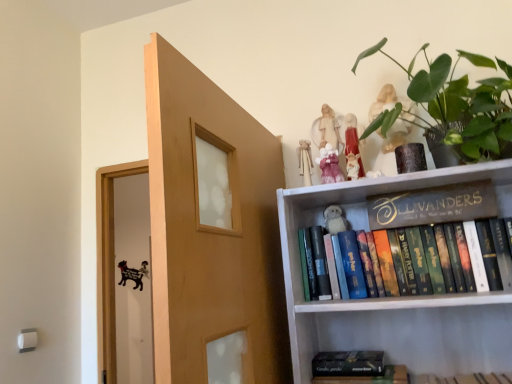
The image size is (512, 384). Find the location of `matte white figurine at upper center, the 3th toy viewed from the front`. matte white figurine at upper center, the 3th toy viewed from the front is located at coordinates click(305, 162).

Measure the distance between point (384, 245) and camera.

The distance of point (384, 245) from camera is 4.36 feet.

What do you see at coordinates (456, 105) in the screenshot? The width and height of the screenshot is (512, 384). I see `green leafy plant at upper right` at bounding box center [456, 105].

Locate an element on the screen. The height and width of the screenshot is (384, 512). light brown wood door at center is located at coordinates (211, 228).

Find the location of a particular element. This screenshot has width=512, height=384. hardcover book at lower center, the 1th book when ordered from bottom to top is located at coordinates (356, 368).

Measure the distance between point (364,354) and camera.

A distance of 4.62 feet exists between point (364,354) and camera.

Find the location of a particular element. This screenshot has width=512, height=384. matte white figurine at upper center, arranged as the second toy when viewed from the back is located at coordinates (305, 162).

Considering the positions of objects pink fabric doll at upper center, the second toy when ordered from front to back, and gold metallic sign at upper right, the third book from the bottom, in the image provided, who is behind, pink fabric doll at upper center, the second toy when ordered from front to back, or gold metallic sign at upper right, the third book from the bottom,?

pink fabric doll at upper center, the second toy when ordered from front to back, is more distant.

From the image's perspective, between pink fabric doll at upper center, the second toy when ordered from front to back, and gold metallic sign at upper right, the third book from the bottom, which one is located above?

pink fabric doll at upper center, the second toy when ordered from front to back.

From the gold metallic sign at upper right, the third book from the bottom, count the 3rd toy to the left and point to it. Please provide its 2D coordinates.

[(329, 165)]

Which point is more distant from viewer, (466, 90) or (362, 360)?

The point (362, 360) is more distant.

Considering the sizes of objects green leafy plant at upper right and hardcover book at lower center, the third book from the top, in the image provided, who is bigger, green leafy plant at upper right or hardcover book at lower center, the third book from the top,?

Bigger between the two is green leafy plant at upper right.

You are a GUI agent. You are given a task and a screenshot of the screen. Output one action in this format:
    pyautogui.click(x=<x>, y=<y>)
    Task: Click on the houseplant above the hardcover book at lower center, the third book from the top (from a real-world perspective)
    
    Given the screenshot: What is the action you would take?
    pyautogui.click(x=456, y=105)

Can you see green leafy plant at upper right touching hardcover book at lower center, the 1th book when ordered from bottom to top?

They are not placed beside each other.

Is green leafy plant at upper right wider or thinner than light brown wood door at center?

Clearly, green leafy plant at upper right has more width compared to light brown wood door at center.

How distant is green leafy plant at upper right from light brown wood door at center?

A distance of 58.54 centimeters exists between green leafy plant at upper right and light brown wood door at center.

Is green leafy plant at upper right facing towards light brown wood door at center?

No, green leafy plant at upper right is not facing towards light brown wood door at center.

Which object is further away from the camera, green leafy plant at upper right or light brown wood door at center?

Positioned behind is green leafy plant at upper right.

From the image's perspective, relative to white plush toy at upper center, acting as the 4th toy starting from the front, is light brown wood door at center above or below?

light brown wood door at center is situated lower than white plush toy at upper center, acting as the 4th toy starting from the front, in the image.

Could you measure the distance between light brown wood door at center and white plush toy at upper center, arranged as the 1th toy when viewed from the back?

light brown wood door at center is 18.35 inches away from white plush toy at upper center, arranged as the 1th toy when viewed from the back.

Is light brown wood door at center located outside white plush toy at upper center, arranged as the 1th toy when viewed from the back?

Absolutely, light brown wood door at center is external to white plush toy at upper center, arranged as the 1th toy when viewed from the back.

Is light brown wood door at center next to white plush toy at upper center, arranged as the 1th toy when viewed from the back, and touching it?

No, light brown wood door at center is not beside white plush toy at upper center, arranged as the 1th toy when viewed from the back.

Which is less distant, (x=357, y=382) or (x=389, y=248)?

The point (x=357, y=382) is in front.

Visually, is hardcover book at lower center, the third book from the top, positioned to the left or to the right of hardcover books at upper right, positioned as the 2th book in top-to-bottom order?

hardcover book at lower center, the third book from the top, is to the left of hardcover books at upper right, positioned as the 2th book in top-to-bottom order.

Which of these two, hardcover book at lower center, the 1th book when ordered from bottom to top, or hardcover books at upper right, which is the 2th book in bottom-to-top order, stands taller?

With more height is hardcover books at upper right, which is the 2th book in bottom-to-top order.

Can you tell me how much hardcover book at lower center, the third book from the top, and hardcover books at upper right, which is the 2th book in bottom-to-top order, differ in facing direction?

0.00109 degrees separate the facing orientations of hardcover book at lower center, the third book from the top, and hardcover books at upper right, which is the 2th book in bottom-to-top order.

Which object is thinner, gold metallic sign at upper right, the third book from the bottom, or light brown wood door at center?

Thinner between the two is gold metallic sign at upper right, the third book from the bottom.

Looking at this image, between gold metallic sign at upper right, the 1th book when ordered from top to bottom, and light brown wood door at center, which one has larger size?

light brown wood door at center.

Considering the relative positions of gold metallic sign at upper right, the 1th book when ordered from top to bottom, and light brown wood door at center in the image provided, is gold metallic sign at upper right, the 1th book when ordered from top to bottom, behind light brown wood door at center?

Yes, the depth of gold metallic sign at upper right, the 1th book when ordered from top to bottom, is greater than that of light brown wood door at center.

From a real-world perspective, who is located lower, matte white figurine at upper center, arranged as the second toy when viewed from the back, or hardcover book at lower center, the 1th book when ordered from bottom to top?

hardcover book at lower center, the 1th book when ordered from bottom to top.

How far apart are matte white figurine at upper center, the 3th toy viewed from the front, and hardcover book at lower center, the third book from the top?

The distance of matte white figurine at upper center, the 3th toy viewed from the front, from hardcover book at lower center, the third book from the top, is 23.61 inches.

Is matte white figurine at upper center, arranged as the second toy when viewed from the back, closer to camera compared to hardcover book at lower center, the third book from the top?

No, matte white figurine at upper center, arranged as the second toy when viewed from the back, is further to the viewer.

Choose the correct answer: Is matte white figurine at upper center, the 3th toy viewed from the front, inside hardcover book at lower center, the 1th book when ordered from bottom to top, or outside it?

matte white figurine at upper center, the 3th toy viewed from the front, is spatially situated outside hardcover book at lower center, the 1th book when ordered from bottom to top.

The height and width of the screenshot is (384, 512). Find the location of `the 2nd toy behind the gold metallic sign at upper right, the third book from the bottom`. the 2nd toy behind the gold metallic sign at upper right, the third book from the bottom is located at coordinates (329, 165).

Where is `houseplant in front of the hardcover book at lower center, the 1th book when ordered from bottom to top`? houseplant in front of the hardcover book at lower center, the 1th book when ordered from bottom to top is located at coordinates (456, 105).

When comparing their distances from matte white figurine at upper center, the 3th toy viewed from the front, does pink fabric doll at upper center, which appears as the third toy when viewed from the back, or matte pink figurine at upper center, which ranks as the 1th toy in front-to-back order, seem further?

matte pink figurine at upper center, which ranks as the 1th toy in front-to-back order, is positioned further to the anchor matte white figurine at upper center, the 3th toy viewed from the front.

Which object lies further to the anchor point white plush toy at upper center, acting as the 4th toy starting from the front, hardcover books at upper right, which is the 2th book in bottom-to-top order, or matte pink figurine at upper center, the fourth toy in the back-to-front sequence?

hardcover books at upper right, which is the 2th book in bottom-to-top order.

Estimate the real-world distances between objects in this image. Which object is further from hardcover book at lower center, the third book from the top, light brown wood door at center or matte pink figurine at upper center, the fourth toy in the back-to-front sequence?

Among the two, matte pink figurine at upper center, the fourth toy in the back-to-front sequence, is located further to hardcover book at lower center, the third book from the top.

Looking at the image, which one is located further to matte white figurine at upper center, arranged as the second toy when viewed from the back, pink fabric doll at upper center, which appears as the third toy when viewed from the back, or green leafy plant at upper right?

green leafy plant at upper right is further to matte white figurine at upper center, arranged as the second toy when viewed from the back.

Looking at the image, which one is located further to light brown wood door at center, hardcover books at upper right, positioned as the 2th book in top-to-bottom order, or matte white figurine at upper center, arranged as the second toy when viewed from the back?

hardcover books at upper right, positioned as the 2th book in top-to-bottom order, lies further to light brown wood door at center than the other object.

In the scene shown: From the image, which object appears to be nearer to matte white figurine at upper center, the 3th toy viewed from the front, gold metallic sign at upper right, the 1th book when ordered from top to bottom, or light brown wood door at center?

gold metallic sign at upper right, the 1th book when ordered from top to bottom.

Based on their spatial positions, is pink fabric doll at upper center, the second toy when ordered from front to back, or green leafy plant at upper right closer to gold metallic sign at upper right, the third book from the bottom?

green leafy plant at upper right.

Which object lies further to the anchor point matte pink figurine at upper center, the fourth toy in the back-to-front sequence, green leafy plant at upper right or hardcover book at lower center, the third book from the top?

hardcover book at lower center, the third book from the top, is further to matte pink figurine at upper center, the fourth toy in the back-to-front sequence.

Where is `book between green leafy plant at upper right and hardcover books at upper right, which is the 2th book in bottom-to-top order, vertically`? book between green leafy plant at upper right and hardcover books at upper right, which is the 2th book in bottom-to-top order, vertically is located at coordinates (433, 205).

The image size is (512, 384). Identify the location of book between gold metallic sign at upper right, the third book from the bottom, and hardcover book at lower center, the 1th book when ordered from bottom to top, from top to bottom. 474,257.

Find the location of a particular element. This screenshot has height=384, width=512. book between white plush toy at upper center, arranged as the 1th toy when viewed from the back, and hardcover book at lower center, the 1th book when ordered from bottom to top, in the up-down direction is located at coordinates (474, 257).

Find the location of a particular element. houseplant located between light brown wood door at center and white plush toy at upper center, arranged as the 1th toy when viewed from the back, in the depth direction is located at coordinates (456, 105).